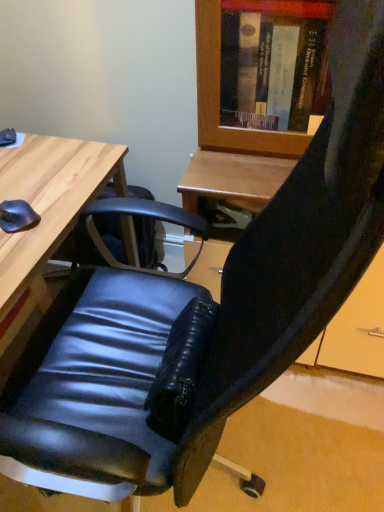
The image size is (384, 512). I want to click on wooden desk at left, so click(x=45, y=220).

What do you see at coordinates (45, 220) in the screenshot? I see `wooden desk at left` at bounding box center [45, 220].

The height and width of the screenshot is (512, 384). Find the location of `wooden desk at left`. wooden desk at left is located at coordinates (45, 220).